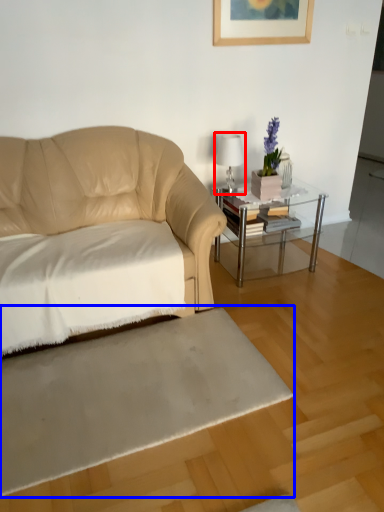
Question: Which point is further to the camera, table lamp (highlighted by a red box) or flat (highlighted by a blue box)?

Choices:
 (A) table lamp
 (B) flat

Answer: (A)